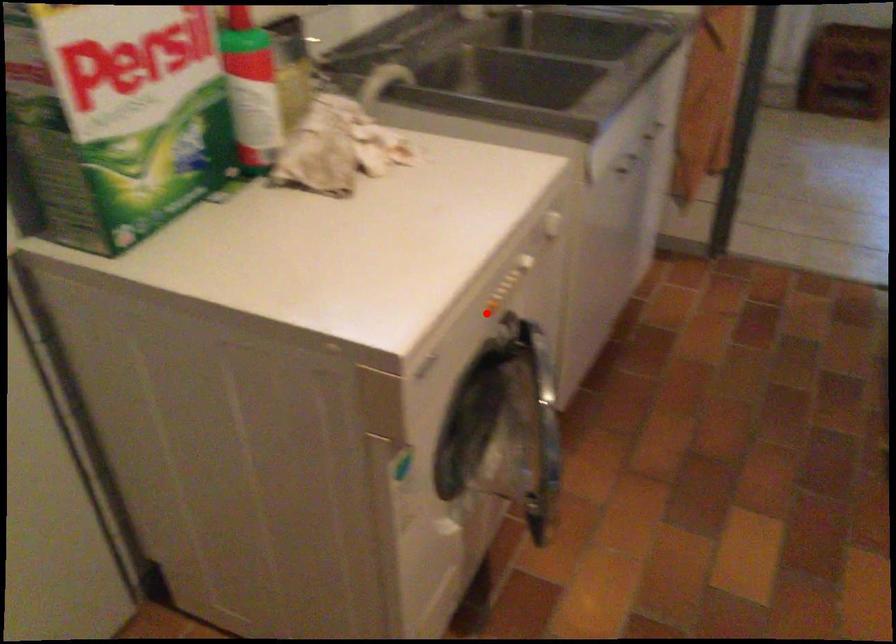
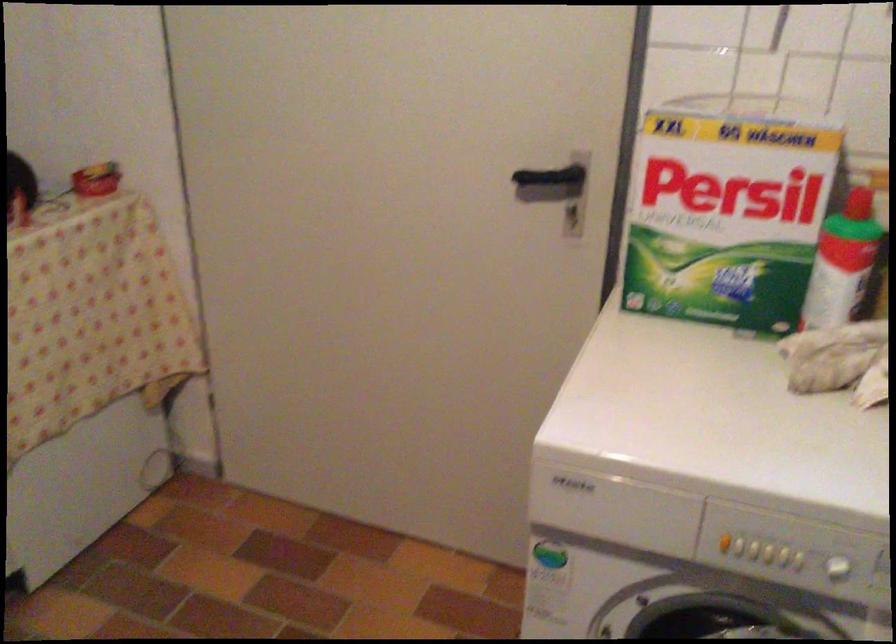
Question: A red point is marked in image1. In image2, is the corresponding 3D point closer to the camera or farther? Reply with the corresponding letter.

Choices:
 (A) The corresponding 3D point is closer.
 (B) The corresponding 3D point is farther.

Answer: (A)